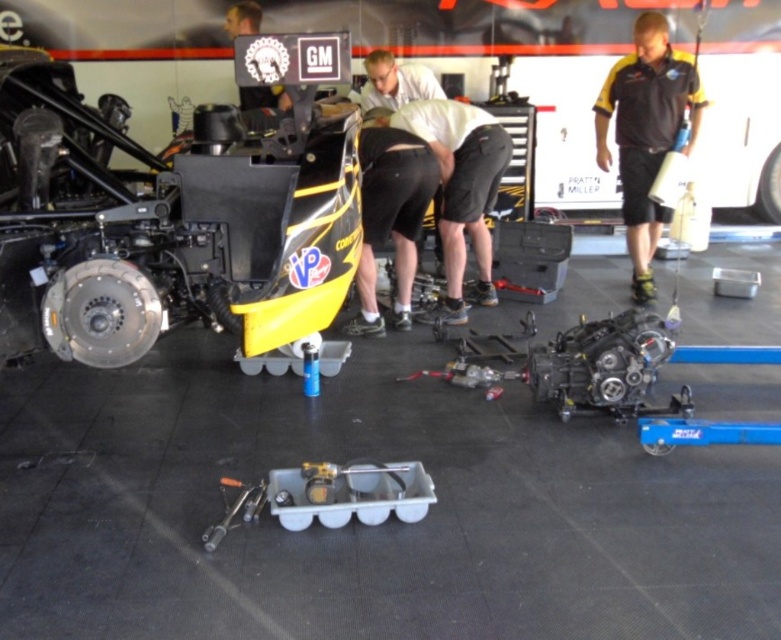
Question: Does black/yellow shirt at right have a greater width compared to white matte shorts at center?

Choices:
 (A) no
 (B) yes

Answer: (A)

Question: Does shiny metallic engine at center have a larger size compared to matte black shorts at center?

Choices:
 (A) no
 (B) yes

Answer: (B)

Question: Does matte black shorts at center appear on the left side of metallic silver wrench at lower center?

Choices:
 (A) yes
 (B) no

Answer: (B)

Question: Which object is farther from the camera taking this photo?

Choices:
 (A) black/yellow shirt at right
 (B) metallic silver wrench at lower center
 (C) matte black shorts at center

Answer: (A)

Question: Which point appears farthest from the camera in this image?

Choices:
 (A) (87, 349)
 (B) (665, 109)
 (C) (244, 102)

Answer: (C)

Question: Which is farther from the white matte shirt at center?

Choices:
 (A) white matte shorts at center
 (B) matte black helmet at upper left
 (C) black/yellow shirt at right
 (D) matte black shorts at center

Answer: (C)